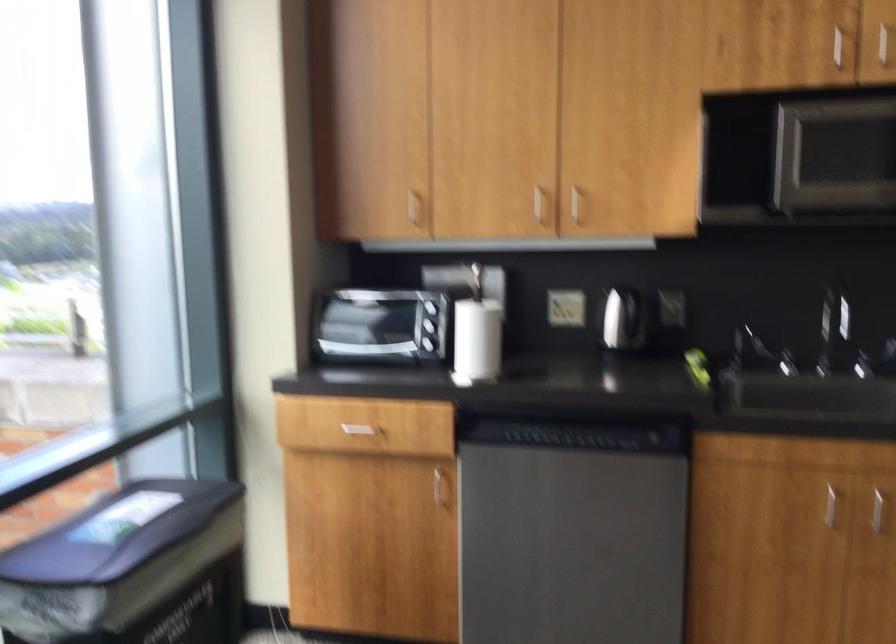
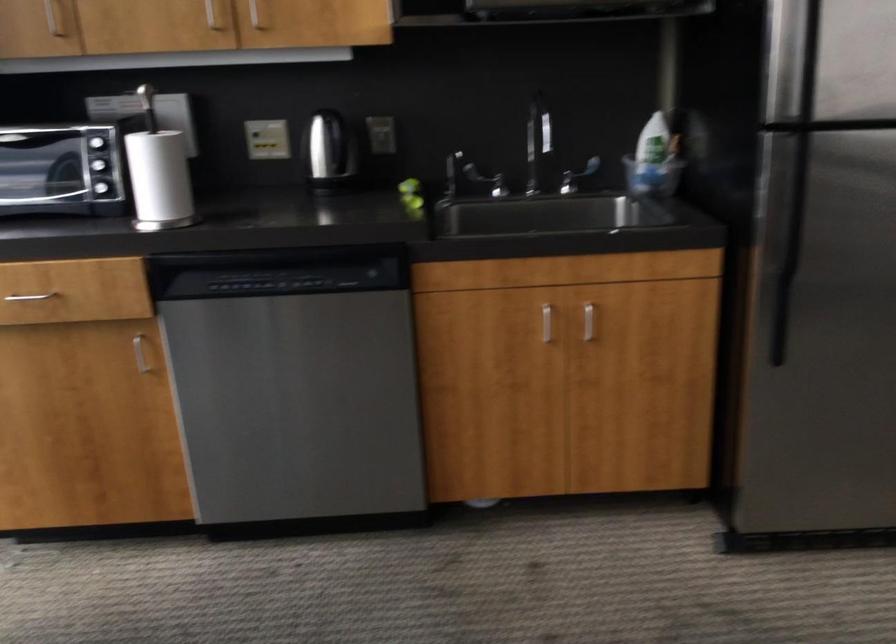
Locate, in the second image, the point that corresponds to pixel 427 322 in the first image.

(99, 162)